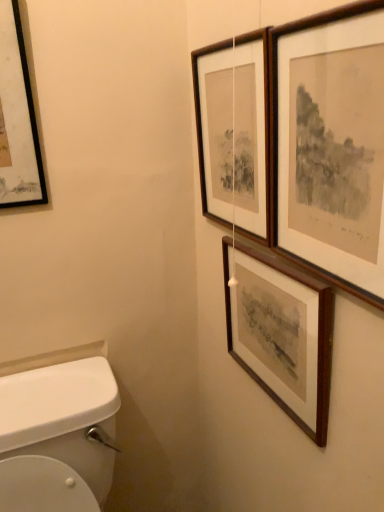
Question: Is wooden picture frame at upper right, the third picture frame from the left, inside the boundaries of wooden picture frame at upper right, which ranks as the second picture frame in left-to-right order, or outside?

Choices:
 (A) outside
 (B) inside

Answer: (A)

Question: Relative to wooden picture frame at upper right, which ranks as the second picture frame in left-to-right order, is wooden picture frame at upper right, the third picture frame from the left, in front or behind?

Choices:
 (A) behind
 (B) front

Answer: (B)

Question: Based on their relative distances, which object is farther from the wooden picture frame at upper right, which ranks as the second picture frame in left-to-right order?

Choices:
 (A) black matte picture frame at upper left, positioned as the first picture frame in left-to-right order
 (B) wooden picture frame at upper right, the third picture frame from the left
 (C) wooden framed print at upper right, marked as the 1th picture frame in a right-to-left arrangement

Answer: (A)

Question: Based on their relative distances, which object is nearer to the wooden picture frame at upper right, which ranks as the second picture frame in left-to-right order?

Choices:
 (A) black matte picture frame at upper left, which is counted as the fourth picture frame, starting from the right
 (B) wooden framed print at upper right, the 4th picture frame in the left-to-right sequence
 (C) wooden picture frame at upper right, the third picture frame from the left

Answer: (B)